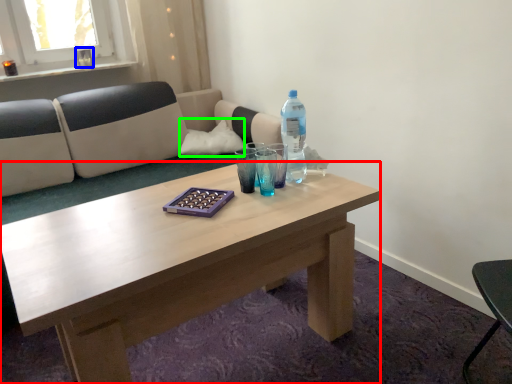
Question: Estimate the real-world distances between objects in this image. Which object is farther from coffee table (highlighted by a red box), glass vase (highlighted by a blue box) or pillow (highlighted by a green box)?

Choices:
 (A) glass vase
 (B) pillow

Answer: (A)